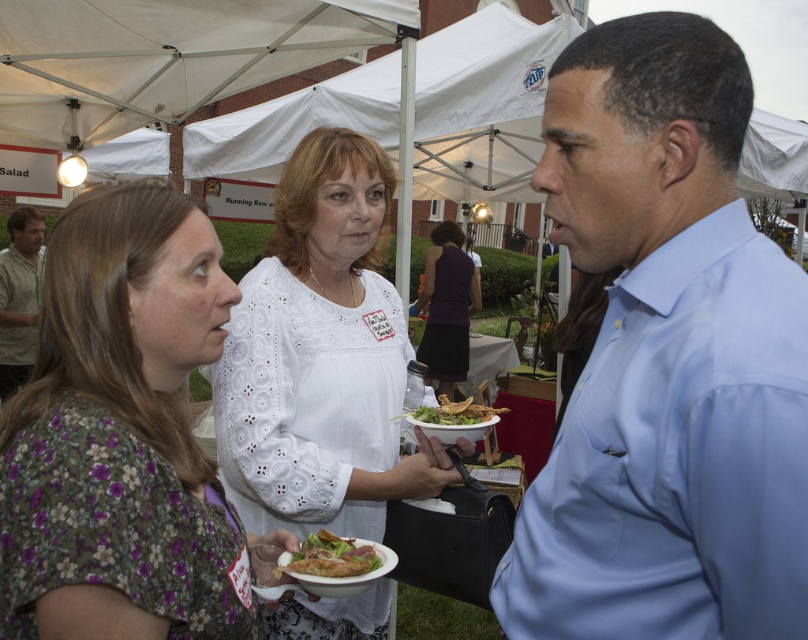
Question: Considering the relative positions of light blue shirt at right and green textured shirt at left in the image provided, where is light blue shirt at right located with respect to green textured shirt at left?

Choices:
 (A) above
 (B) below

Answer: (B)

Question: Does floral fabric dress at center appear on the left side of white lace blouse at center?

Choices:
 (A) yes
 (B) no

Answer: (A)

Question: Which object appears closest to the camera in this image?

Choices:
 (A) green textured shirt at left
 (B) light blue shirt at right
 (C) crunchy fried chicken at center

Answer: (B)

Question: Is light blue shirt at right thinner than white lace blouse at center?

Choices:
 (A) no
 (B) yes

Answer: (B)

Question: Which point is farther to the camera?

Choices:
 (A) dark purple dress at center
 (B) white fabric canopy at upper left

Answer: (A)

Question: Which point appears farthest from the camera in this image?

Choices:
 (A) (735, 250)
 (B) (316, 545)
 (C) (83, 376)

Answer: (B)